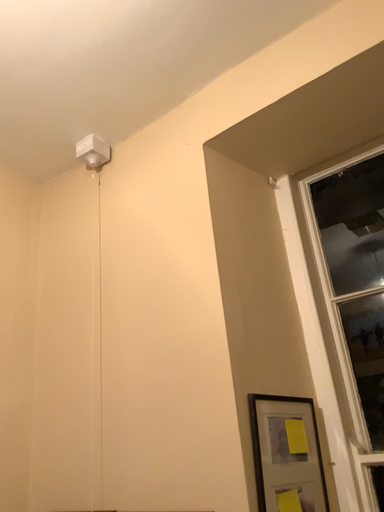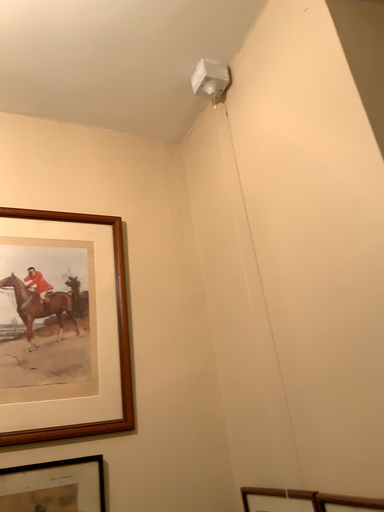
Question: Which way did the camera rotate in the video?

Choices:
 (A) rotated left
 (B) rotated right

Answer: (A)